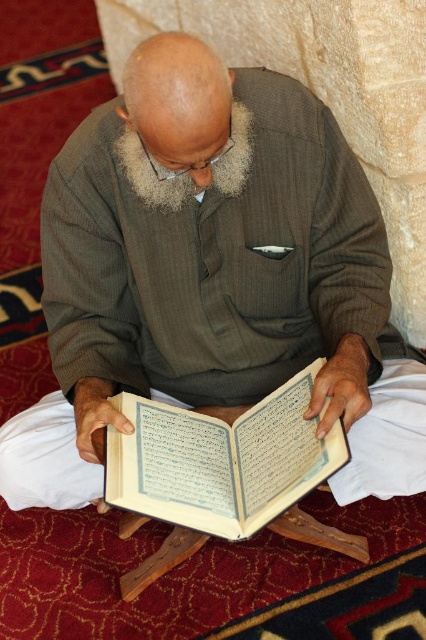
You are a photographer standing at a distance, trying to capture a closeup shot of the brown textured sweater at center worn by the elderly man. Your camera has a minimum focusing distance of 40 inches. Will you be able to take the photo without moving closer?

The brown textured sweater at center is 38.78 inches away from the viewer, which is closer than the camera minimum focusing distance of 40 inches. Therefore, the camera cannot focus on the sweater at this distance.

You are a tailor measuring the width of items in the scene. Which item has a greater width between the brown textured sweater at center and the white fluffy beard at center?

The brown textured sweater at center has a greater width than the white fluffy beard at center.